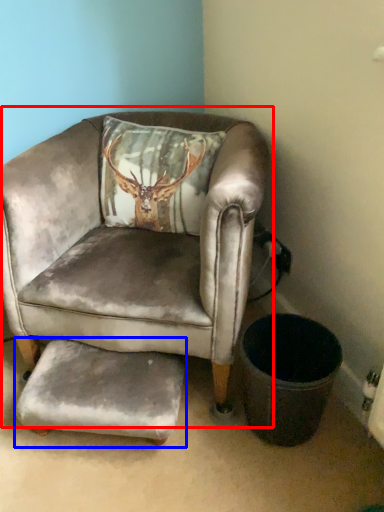
Question: Which object is further to the camera taking this photo, chair (highlighted by a red box) or footrest (highlighted by a blue box)?

Choices:
 (A) chair
 (B) footrest

Answer: (B)